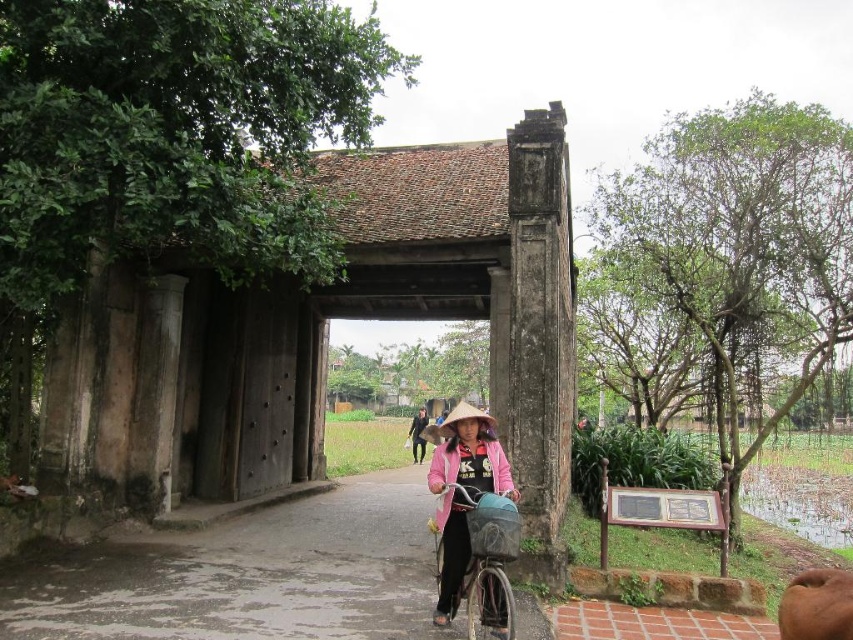
You are standing at the entrance of the gate and want to take a photo of the metallic silver bicycle at center and the black matte jacket at center. Which object should you focus on first if you want to ensure both are in focus, considering their heights?

The metallic silver bicycle at center is taller than the black matte jacket at center, so you should focus on the metallic silver bicycle at center first to ensure both are in focus.

You are a photographer standing at the entrance of the traditional gate. You want to take a photo of the metallic silver bicycle at center and the brown straw hat at center. Which object appears narrower in the photo?

The metallic silver bicycle at center appears narrower than the brown straw hat at center in the photo.